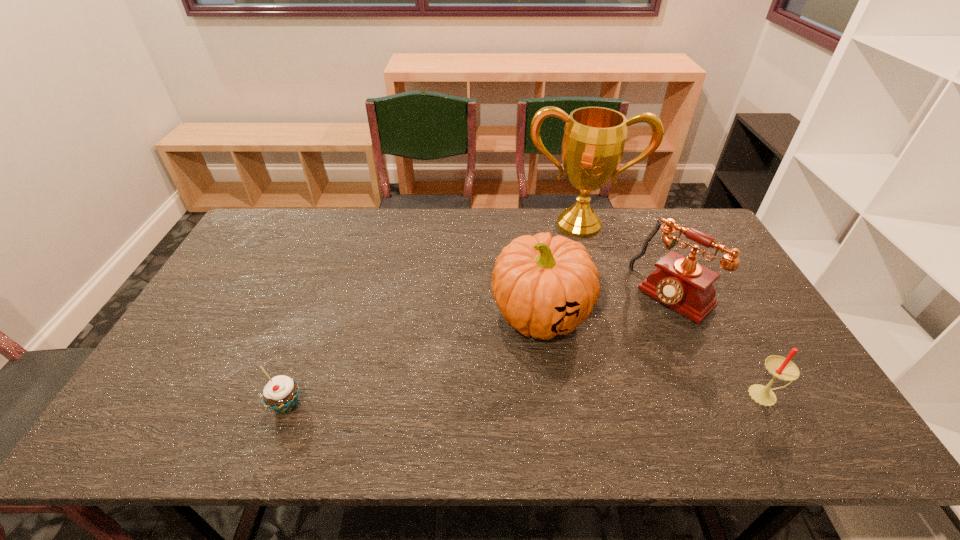
What are the coordinates of `candle present at the near edge` in the screenshot? It's located at (780, 367).

Identify the location of candle present at the right edge. Image resolution: width=960 pixels, height=540 pixels. (780, 367).

What are the coordinates of `telephone that is at the right edge` in the screenshot? It's located at (679, 282).

Image resolution: width=960 pixels, height=540 pixels. I want to click on object that is at the near right corner, so click(780, 367).

Where is `vacant space at the far edge of the desktop`? Image resolution: width=960 pixels, height=540 pixels. vacant space at the far edge of the desktop is located at coordinates (357, 218).

In the image, there is a desktop. Where is `vacant space at the near edge`? vacant space at the near edge is located at coordinates (343, 395).

Where is `vacant space at the left edge of the desktop`? The image size is (960, 540). vacant space at the left edge of the desktop is located at coordinates (236, 258).

Where is `vacant space at the right edge of the desktop`? Image resolution: width=960 pixels, height=540 pixels. vacant space at the right edge of the desktop is located at coordinates (718, 305).

Find the location of `vacant space at the near left corner of the desktop`. vacant space at the near left corner of the desktop is located at coordinates (203, 406).

Identify the location of free spot between the pumpkin and the cupcake. (414, 359).